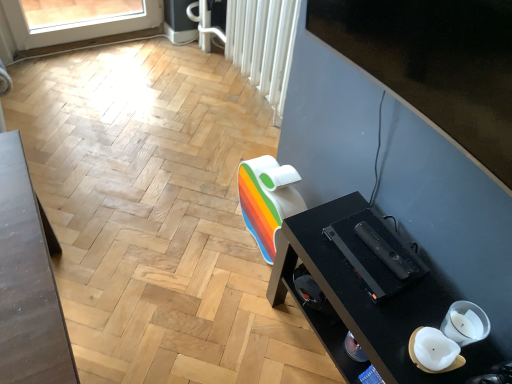
Find the location of `blank space situated above black glossy desk at lower right (from a real-world perspective)`. blank space situated above black glossy desk at lower right (from a real-world perspective) is located at coordinates (381, 294).